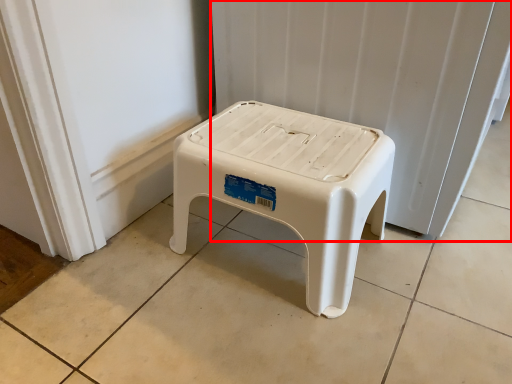
Question: Considering the relative positions of radiator (annotated by the red box) and stool in the image provided, where is radiator (annotated by the red box) located with respect to the staircase?

Choices:
 (A) right
 (B) left

Answer: (A)